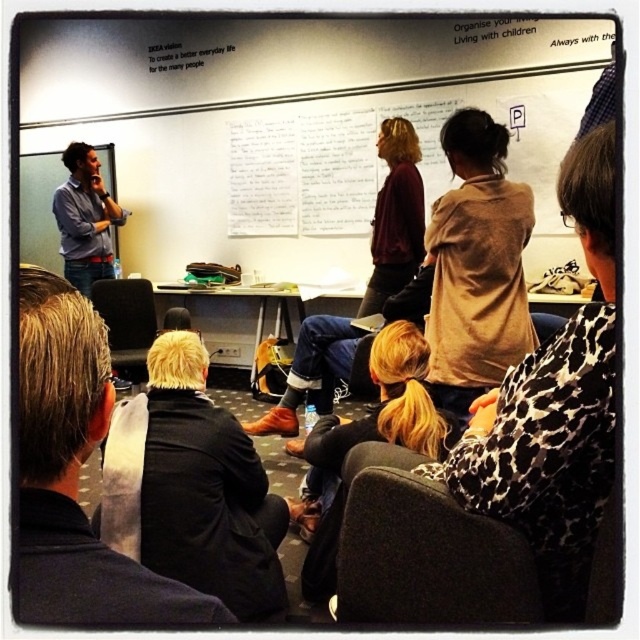
Question: Which point appears farthest from the camera in this image?

Choices:
 (A) (108, 266)
 (B) (58, 593)

Answer: (A)

Question: Is dark brown hair at lower left positioned behind matte blue shirt at left?

Choices:
 (A) no
 (B) yes

Answer: (A)

Question: From the image, what is the correct spatial relationship of dark brown hair at lower left in relation to matte blue shirt at left?

Choices:
 (A) left
 (B) right

Answer: (B)

Question: Among these points, which one is farthest from the camera?

Choices:
 (A) (81, 253)
 (B) (141, 620)

Answer: (A)

Question: Does dark brown hair at lower left have a smaller size compared to matte blue shirt at left?

Choices:
 (A) no
 (B) yes

Answer: (B)